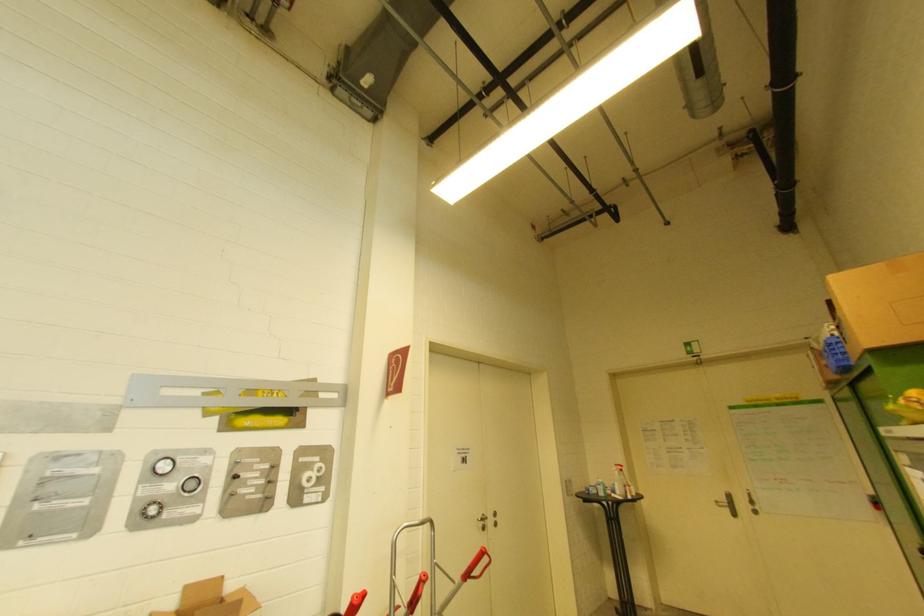
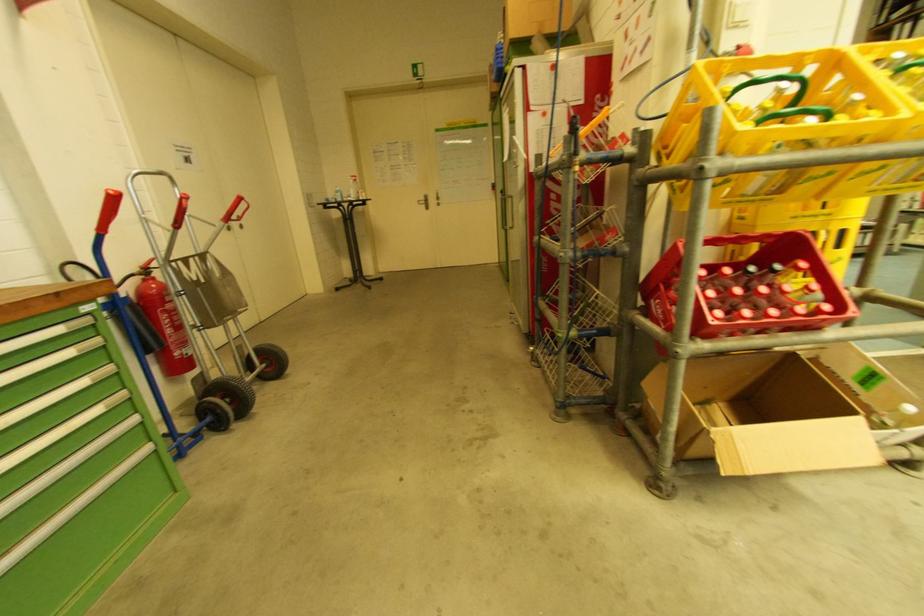
The images are taken continuously from a first-person perspective. In which direction is your viewpoint rotating?

The camera's rotation is toward right-down.